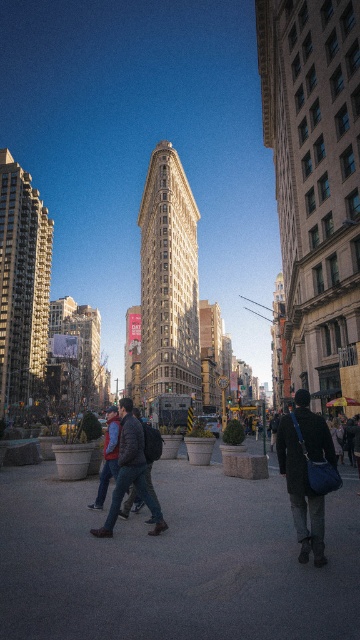
In the scene shown: Who is more distant from viewer, (311,435) or (123,476)?

Positioned behind is point (123,476).

This screenshot has width=360, height=640. I want to click on matte black jacket at center, so click(x=308, y=472).

Where is `matte black jacket at center`? This screenshot has width=360, height=640. matte black jacket at center is located at coordinates (308, 472).

Does point (29, 612) come closer to viewer compared to point (102, 532)?

Yes, it is.

Identify the location of dark gray concrete pavement at center. This screenshot has width=360, height=640. point(173,561).

Where is `dark gray concrete pavement at center`? This screenshot has height=640, width=360. dark gray concrete pavement at center is located at coordinates (173, 561).

Does dark gray concrete pavement at center have a lesser width compared to matte black jacket at center?

No.

Who is more distant from viewer, (209, 492) or (307, 532)?

The point (209, 492) is more distant.

Is point (291, 552) behind point (300, 520)?

Yes, point (291, 552) is farther from viewer.

Where is `dark gray concrete pavement at center`? dark gray concrete pavement at center is located at coordinates (173, 561).